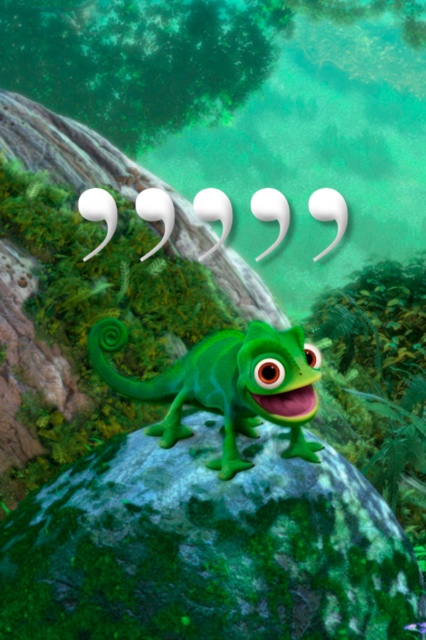
Consider the image. You are a researcher studying the positioning of objects in natural environments. You have a coordinate grid overlay on the image where the bottom left corner is the origin point. Based on the scene, where is the green mossy rock at center located?

The green mossy rock at center is located at point (206, 548).

You are a nature photographer aiming to capture the green mossy rock at center and the green rubber lizard at center in a single frame. Based on their positions, which object should you focus on first to ensure both are in focus?

The green mossy rock at center is below the green rubber lizard at center, so you should focus on the green mossy rock at center first to ensure both are in focus since it is closer to the camera.